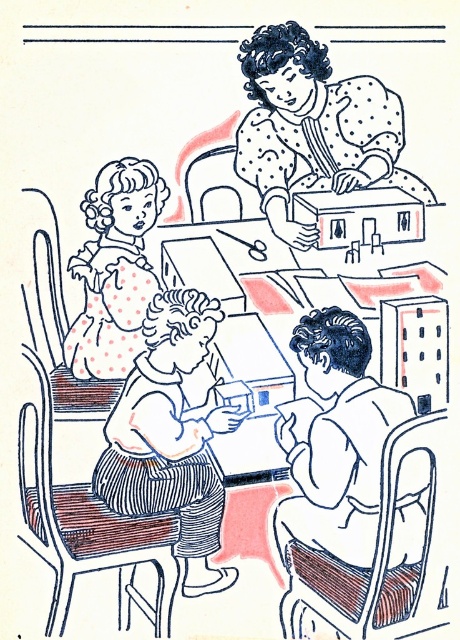
Question: Is striped fabric skirt at center below polka dot fabric doll at upper left?

Choices:
 (A) yes
 (B) no

Answer: (A)

Question: Can you confirm if striped fabric skirt at center is positioned below polka dot fabric doll at upper left?

Choices:
 (A) no
 (B) yes

Answer: (B)

Question: In this image, where is striped fabric skirt at center located relative to polka dot fabric doll at upper left?

Choices:
 (A) above
 (B) below

Answer: (B)

Question: Which point is closer to the camera taking this photo?

Choices:
 (A) (189, 509)
 (B) (116, 326)

Answer: (B)

Question: Which of the following is the farthest from the observer?

Choices:
 (A) (145, 436)
 (B) (149, 163)

Answer: (A)